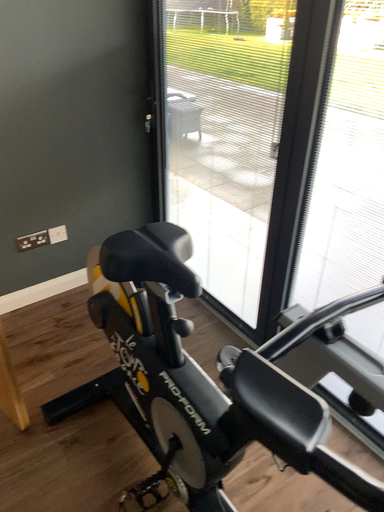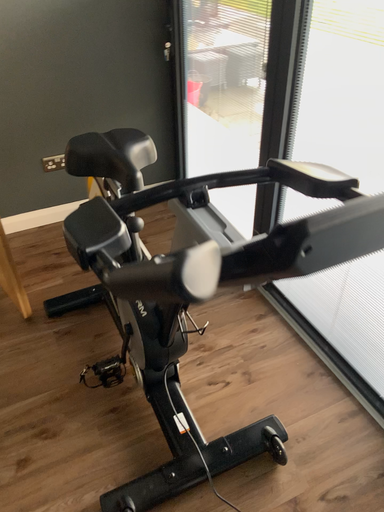
Question: Which way did the camera rotate in the video?

Choices:
 (A) rotated left
 (B) rotated right

Answer: (A)